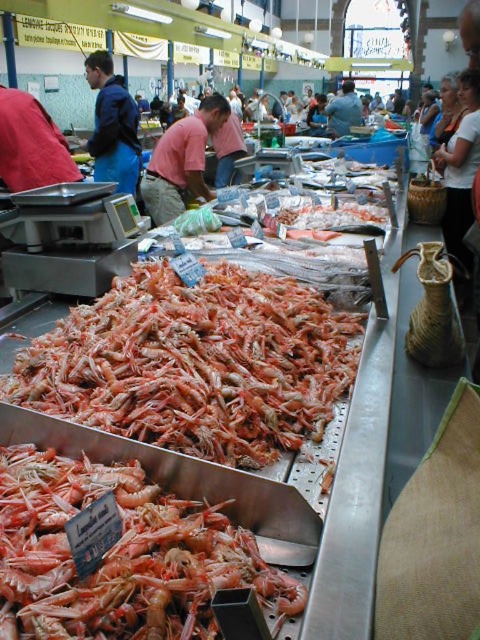
You are a customer at the seafood market and want to buy a shirt. You need to know which one is larger between the pink cotton shirt at center and the blue fabric jacket at upper left. Which one should you choose?

The pink cotton shirt at center is bigger than the blue fabric jacket at upper left, so you should choose the pink cotton shirt at center if you want a larger size.

Consider the image. You are a customer looking to buy seafood and see two people in the market. One is wearing a pink cotton shirt at center and the other a blue fabric jacket at upper left. Which seller is closer to the display case with fresh pink prawns?

The pink cotton shirt at center is positioned on the right side of the blue fabric jacket at upper left. Since the display case with fresh pink prawns is in the foreground, the pink cotton shirt at center is closer to the display case.